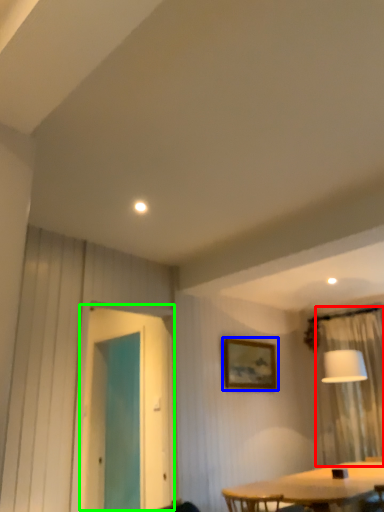
Question: Which object is the closest to the curtain (highlighted by a red box)? Choose among these: picture frame (highlighted by a blue box) or screen door (highlighted by a green box).

Choices:
 (A) picture frame
 (B) screen door

Answer: (A)